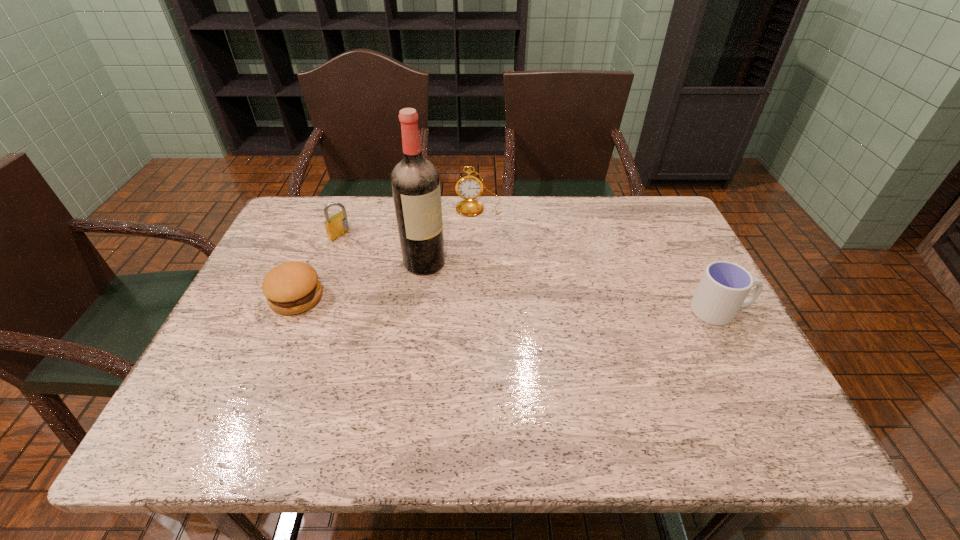
This screenshot has width=960, height=540. I want to click on free space located on the front-facing side of the third object from left to right, so click(x=525, y=328).

This screenshot has width=960, height=540. Identify the location of vacant area situated on the face of the farthest object. (483, 301).

Where is `free space located on the face of the farthest object`? free space located on the face of the farthest object is located at coordinates (480, 235).

You are a GUI agent. You are given a task and a screenshot of the screen. Output one action in this format:
    pyautogui.click(x=<x>, y=<y>)
    Task: Click on the vacant space situated 0.080m on the face of the farthest object
    This screenshot has height=540, width=960.
    Given the screenshot: What is the action you would take?
    pyautogui.click(x=480, y=233)

At what (x,y) coordinates should I click in order to perform the action: click on blank space located on the side with the combination dials of the padlock. Please return your answer as a coordinate pair (x, y). This screenshot has width=960, height=540. Looking at the image, I should click on (393, 260).

Locate an element on the screen. free space located 0.340m on the side with the combination dials of the padlock is located at coordinates (442, 284).

The height and width of the screenshot is (540, 960). Find the location of `vacant space located on the side with the combination dials of the padlock`. vacant space located on the side with the combination dials of the padlock is located at coordinates (384, 256).

Locate an element on the screen. The image size is (960, 540). pocket watch present at the far edge is located at coordinates (469, 187).

At what (x,y) coordinates should I click in order to perform the action: click on padlock positioned at the far edge. Please return your answer as a coordinate pair (x, y). The width and height of the screenshot is (960, 540). Looking at the image, I should click on (337, 225).

Locate an element on the screen. hamburger present at the left edge is located at coordinates (290, 288).